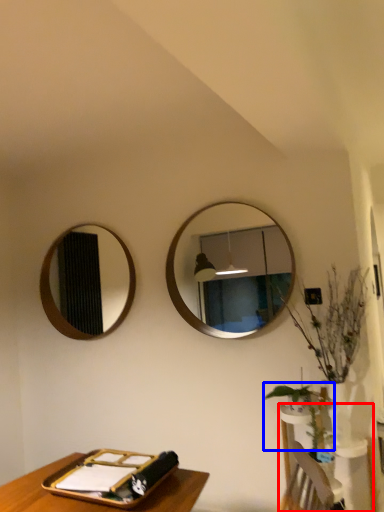
Question: Which object is closer to the camera taking this photo, vanity (highlighted by a red box) or plant (highlighted by a blue box)?

Choices:
 (A) vanity
 (B) plant

Answer: (A)